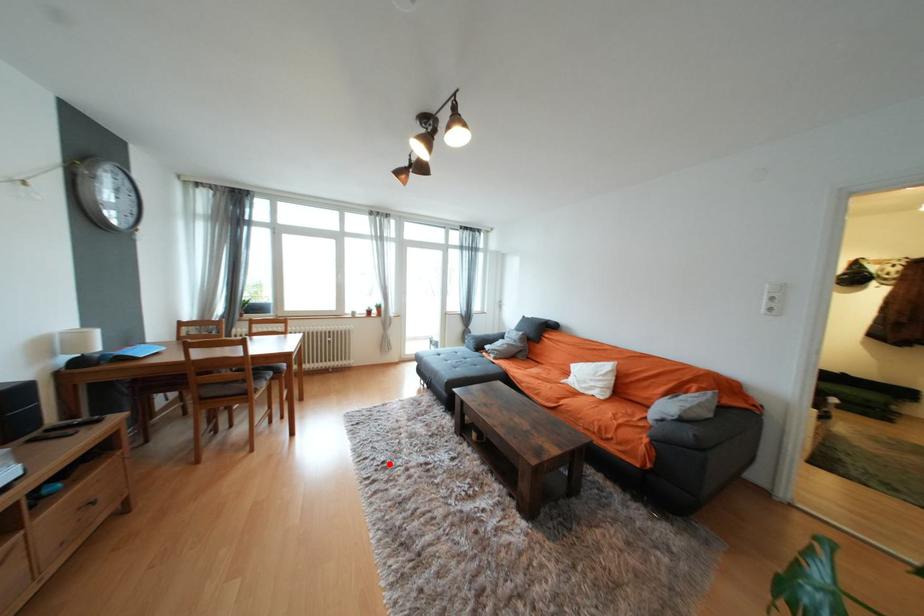
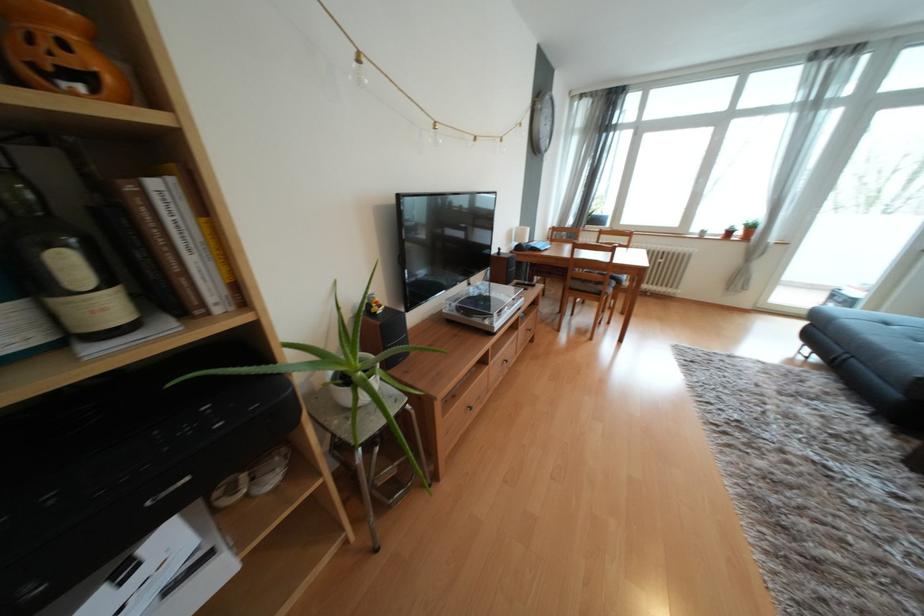
In the second image, find the point that corresponds to the highlighted location in the first image.

(745, 424)